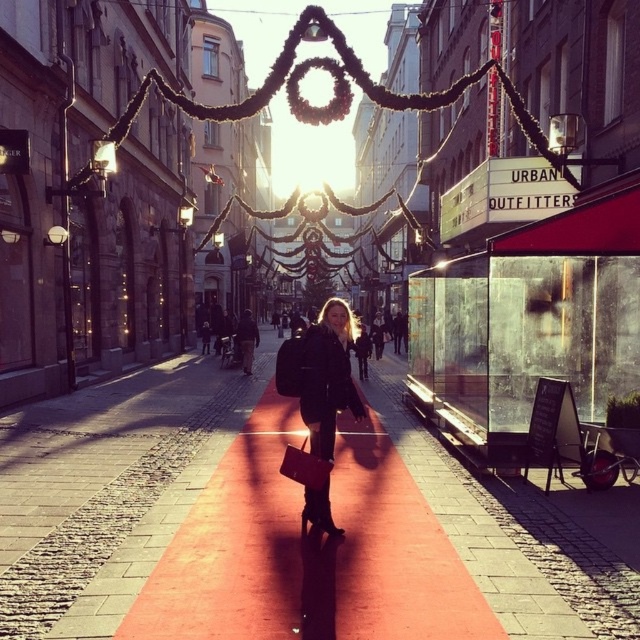
Is matte black coat at center to the right of leather jacket at center from the viewer's perspective?

Indeed, matte black coat at center is positioned on the right side of leather jacket at center.

Image resolution: width=640 pixels, height=640 pixels. What do you see at coordinates (326, 376) in the screenshot?
I see `matte black coat at center` at bounding box center [326, 376].

You are a GUI agent. You are given a task and a screenshot of the screen. Output one action in this format:
    pyautogui.click(x=<x>, y=<y>)
    Task: Click on the matte black coat at center
    The height and width of the screenshot is (640, 640).
    Given the screenshot: What is the action you would take?
    pyautogui.click(x=326, y=376)

What are the coordinates of `matte black coat at center` in the screenshot? It's located at (326, 376).

Between smooth red carpet at center and leather jacket at center, which one has more height?

leather jacket at center

Does smooth red carpet at center lie behind leather jacket at center?

No, smooth red carpet at center is closer to the viewer.

Image resolution: width=640 pixels, height=640 pixels. Identify the location of smooth red carpet at center. (308, 552).

You are a GUI agent. You are given a task and a screenshot of the screen. Output one action in this format:
    pyautogui.click(x=<x>, y=<y>)
    Task: Click on the smooth red carpet at center
    The height and width of the screenshot is (640, 640).
    Given the screenshot: What is the action you would take?
    (308, 552)

Which is in front, point (406, 500) or point (320, 374)?

Positioned in front is point (320, 374).

This screenshot has width=640, height=640. In order to click on smooth red carpet at center in this screenshot , I will do `click(308, 552)`.

Describe the element at coordinates (308, 552) in the screenshot. I see `smooth red carpet at center` at that location.

Identify the location of smooth red carpet at center. (308, 552).